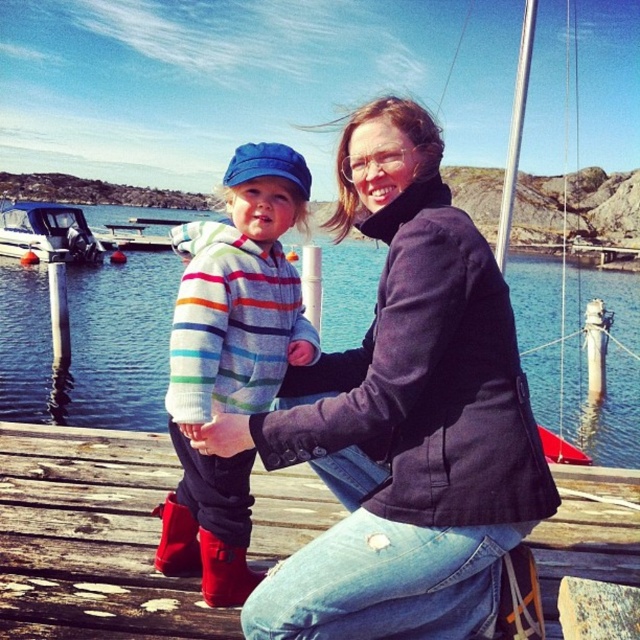
Describe the element at coordinates (225, 572) in the screenshot. I see `red rubber boot at lower center` at that location.

Which is behind, point (240, 602) or point (164, 548)?

The point (164, 548) is more distant.

What do you see at coordinates (225, 572) in the screenshot? I see `red rubber boot at lower center` at bounding box center [225, 572].

Find the location of a particular element. red rubber boot at lower center is located at coordinates (225, 572).

Is blue water at dock center behind striped fleece sweater at center?

Yes, blue water at dock center is further from the viewer.

Looking at this image, which is above, blue water at dock center or striped fleece sweater at center?

blue water at dock center is higher up.

Image resolution: width=640 pixels, height=640 pixels. Identify the location of blue water at dock center. (90, 342).

Between point (266, 472) and point (248, 192), which one is positioned behind?

Point (266, 472)

Is wooden at lower left positioned in front of striped fleece sweater at center?

Yes, wooden at lower left is closer to the viewer.

Image resolution: width=640 pixels, height=640 pixels. Find the location of `wooden at lower left`. wooden at lower left is located at coordinates (90, 538).